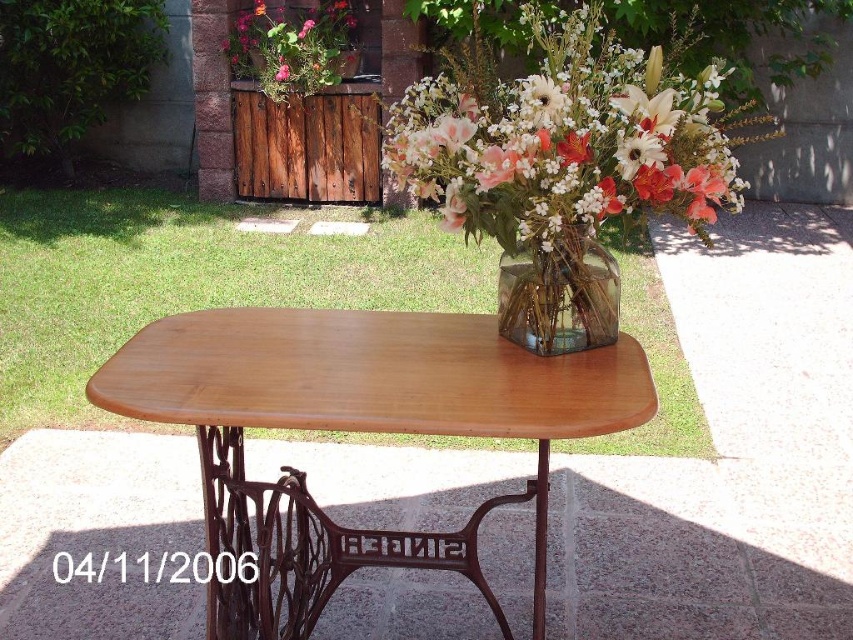
Who is more distant from viewer, (601, 410) or (335, 77)?

The point (335, 77) is behind.

Image resolution: width=853 pixels, height=640 pixels. Identify the location of light brown wood table at center. (355, 429).

Between transparent glass vase at center and matte plastic flowers at upper center, which one is positioned lower?

Positioned lower is transparent glass vase at center.

What do you see at coordinates (560, 298) in the screenshot?
I see `transparent glass vase at center` at bounding box center [560, 298].

Locate an element on the screen. Image resolution: width=853 pixels, height=640 pixels. transparent glass vase at center is located at coordinates (560, 298).

Does light brown wood table at center have a larger size compared to transparent glass vase at center?

Correct, light brown wood table at center is larger in size than transparent glass vase at center.

Between light brown wood table at center and transparent glass vase at center, which one appears on the right side from the viewer's perspective?

Positioned to the right is transparent glass vase at center.

Where is `light brown wood table at center`? The height and width of the screenshot is (640, 853). light brown wood table at center is located at coordinates (355, 429).